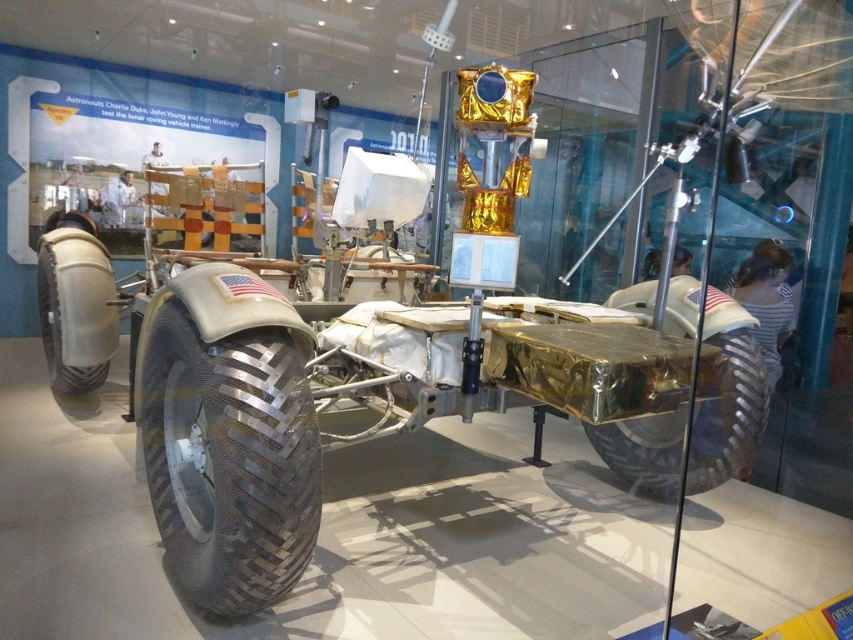
Question: Does metallic silver tire at lower left appear under shiny metallic tire at lower right?

Choices:
 (A) no
 (B) yes

Answer: (A)

Question: Considering the real-world distances, which object is farthest from the rubber/textured tire at lower left?

Choices:
 (A) shiny metallic tire at lower right
 (B) metallic silver tire at lower left

Answer: (A)

Question: Can you confirm if metallic silver tire at lower left is positioned to the right of rubber/textured tire at lower left?

Choices:
 (A) no
 (B) yes

Answer: (B)

Question: Which point appears farthest from the camera in this image?

Choices:
 (A) (757, 364)
 (B) (84, 362)

Answer: (B)

Question: Can you confirm if metallic silver tire at lower left is positioned below shiny metallic tire at lower right?

Choices:
 (A) yes
 (B) no

Answer: (B)

Question: Which of these objects is positioned closest to the shiny metallic tire at lower right?

Choices:
 (A) metallic silver tire at lower left
 (B) rubber/textured tire at lower left

Answer: (A)